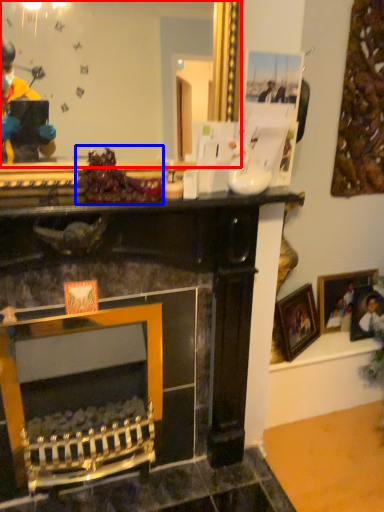
Question: Which object is closer to the camera taking this photo, mirror (highlighted by a red box) or food (highlighted by a blue box)?

Choices:
 (A) mirror
 (B) food

Answer: (A)